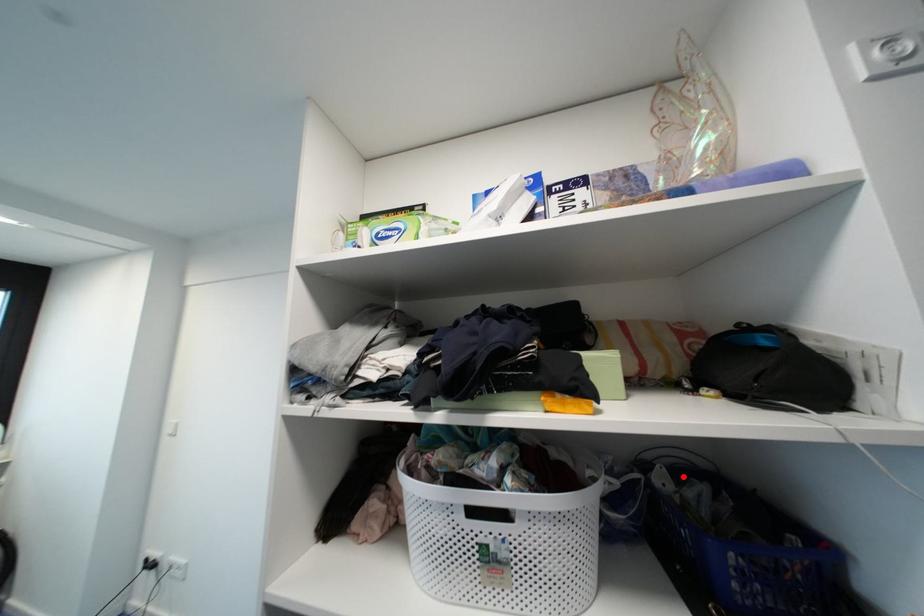
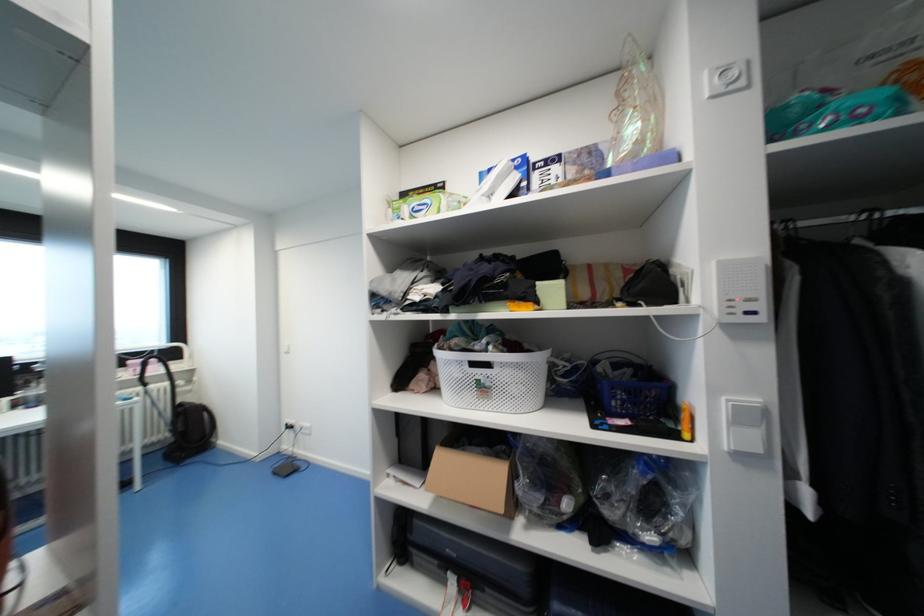
Where in the second image is the point corresponding to the highlighted location from the first image?

(621, 367)